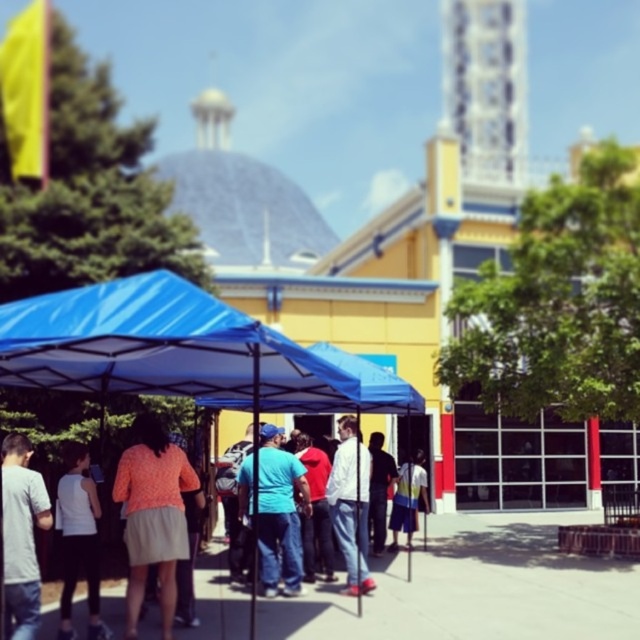
Question: Which of the following is the farthest from the observer?

Choices:
 (A) (378, 502)
 (B) (129, 509)
 (C) (10, 435)
 (D) (332, 545)

Answer: (A)

Question: Does orange fabric shirt at center appear under dark blue jeans at center?

Choices:
 (A) yes
 (B) no

Answer: (A)

Question: Which object is the farthest from the white matte tank top at lower left?

Choices:
 (A) white matte shirt at center
 (B) blue cotton shirt at center

Answer: (A)

Question: Estimate the real-world distances between objects in this image. Which object is farther from the orange fabric skirt at center?

Choices:
 (A) blue denim jeans at center
 (B) white matte tank top at lower left
 (C) gray cotton t-shirt at lower left
 (D) dark blue jeans at center

Answer: (D)

Question: Is orange fabric skirt at center bigger than blue cotton shirt at center?

Choices:
 (A) no
 (B) yes

Answer: (A)

Question: Does gray cotton t-shirt at lower left appear over white matte tank top at lower left?

Choices:
 (A) yes
 (B) no

Answer: (A)